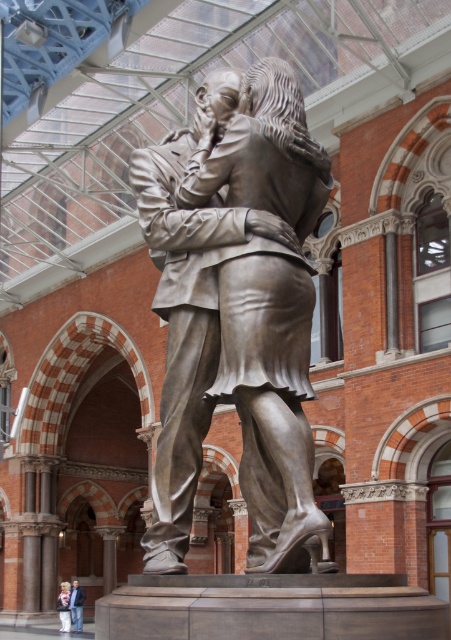
Between blue jeans at lower left and white cotton shirt at lower left, which one has less height?

white cotton shirt at lower left is shorter.

Does blue jeans at lower left appear over white cotton shirt at lower left?

Correct, blue jeans at lower left is located above white cotton shirt at lower left.

Is point (78, 620) behind point (64, 628)?

That is True.

This screenshot has height=640, width=451. What are the coordinates of `blue jeans at lower left` in the screenshot? It's located at (77, 605).

Is bronze statue at center wider than white cotton shirt at lower left?

Yes, bronze statue at center is wider than white cotton shirt at lower left.

In the scene shown: Is bronze statue at center below white cotton shirt at lower left?

No, bronze statue at center is not below white cotton shirt at lower left.

In order to click on bronze statue at center in this screenshot , I will do `click(191, 305)`.

Locate an element on the screen. bronze statue at center is located at coordinates (191, 305).

Which is behind, point (148, 154) or point (77, 580)?

Point (77, 580)

Which is above, bronze statue at center or blue jeans at lower left?

bronze statue at center

Identify the location of bronze statue at center. (191, 305).